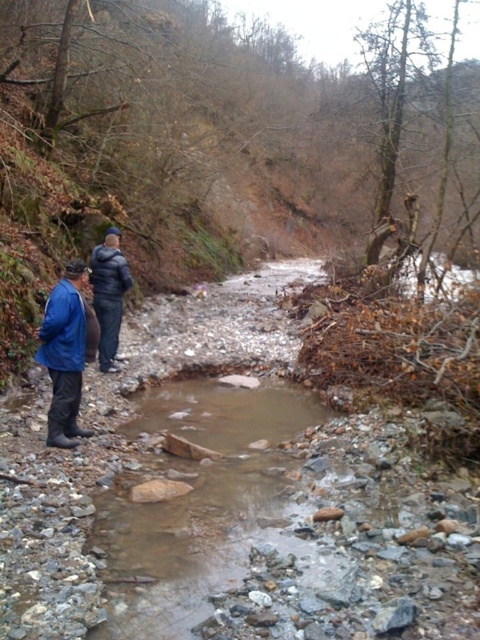
You are a hiker trying to cross the stream safely. You see the blue fabric jacket at lower left and the dark blue down jacket at center. Which person should you ask for help first if you need assistance, considering their height?

The dark blue down jacket at center is taller than the blue fabric jacket at lower left, so you should ask the person in the dark blue down jacket at center for help first.

You are a hiker trying to cross the stream. You see two points marked in the image. Which point, point (52, 374) or point (115, 342), is closer to you and would be easier to reach first?

Point (52, 374) is closer to the viewer than point (115, 342), so it would be easier to reach first.

You are hiking in the forest and see the blue fabric jacket at lower left and the dark blue down jacket at center. Which jacket is positioned more to the east if you are facing north?

The blue fabric jacket at lower left is positioned more to the east because it is to the right of the dark blue down jacket at center when facing north.